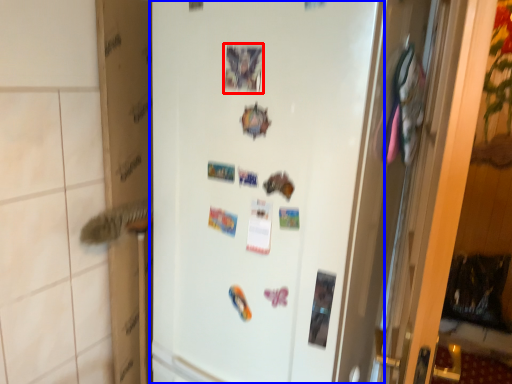
Question: Which object appears farthest to the camera in this image, postcard (highlighted by a red box) or refrigerator (highlighted by a blue box)?

Choices:
 (A) postcard
 (B) refrigerator

Answer: (A)